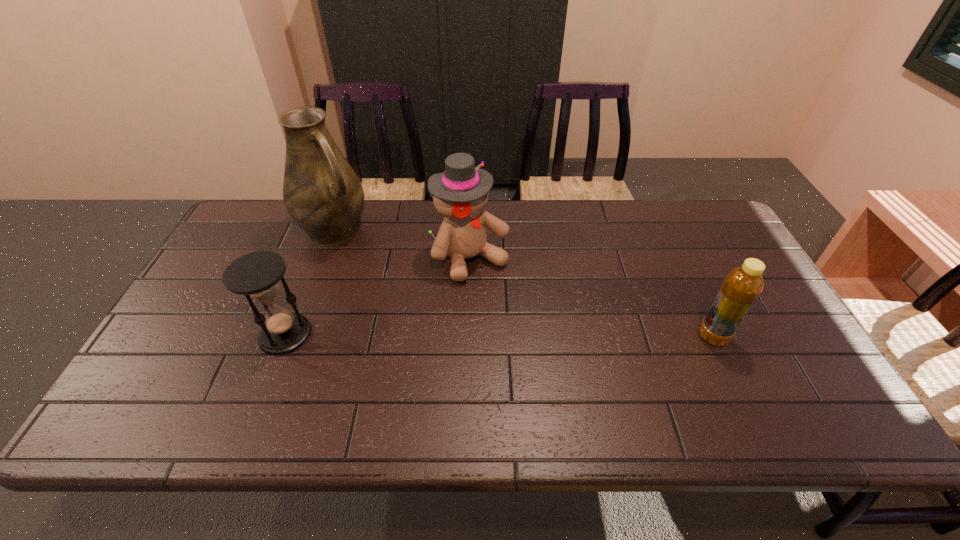
The width and height of the screenshot is (960, 540). I want to click on vacant area located on the front-facing side of the third shortest object, so click(x=510, y=301).

Find the location of a particular element. free space located 0.070m on the front-facing side of the third shortest object is located at coordinates (506, 296).

Find the location of `vacant space located 0.350m on the front-facing side of the third shortest object`. vacant space located 0.350m on the front-facing side of the third shortest object is located at coordinates (572, 369).

The width and height of the screenshot is (960, 540). I want to click on pitcher located at the far edge, so click(x=322, y=193).

Identify the location of rag_doll situated at the far edge. The image size is (960, 540). (460, 193).

The width and height of the screenshot is (960, 540). In the image, there is a desktop. Find the location of `vacant space at the far edge`. vacant space at the far edge is located at coordinates (673, 228).

The height and width of the screenshot is (540, 960). In order to click on free spot at the near edge of the desktop in this screenshot , I will do `click(570, 378)`.

This screenshot has height=540, width=960. In the image, there is a desktop. In order to click on vacant space at the left edge in this screenshot , I will do `click(160, 351)`.

The height and width of the screenshot is (540, 960). What are the coordinates of `vacant space at the far left corner of the desktop` in the screenshot? It's located at coord(257,214).

Locate an element on the screen. vacant space at the far right corner of the desktop is located at coordinates 702,225.